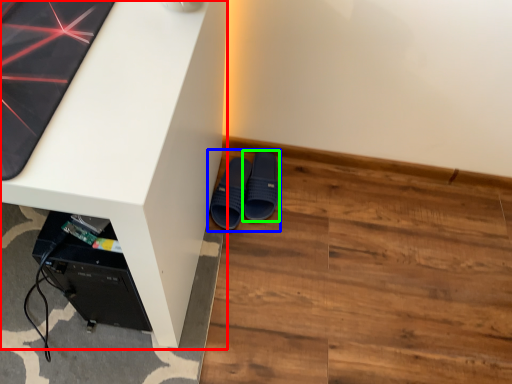
Question: Estimate the real-world distances between objects in this image. Which object is farther from desk (highlighted by a red box), footwear (highlighted by a blue box) or footwear (highlighted by a green box)?

Choices:
 (A) footwear
 (B) footwear

Answer: (B)